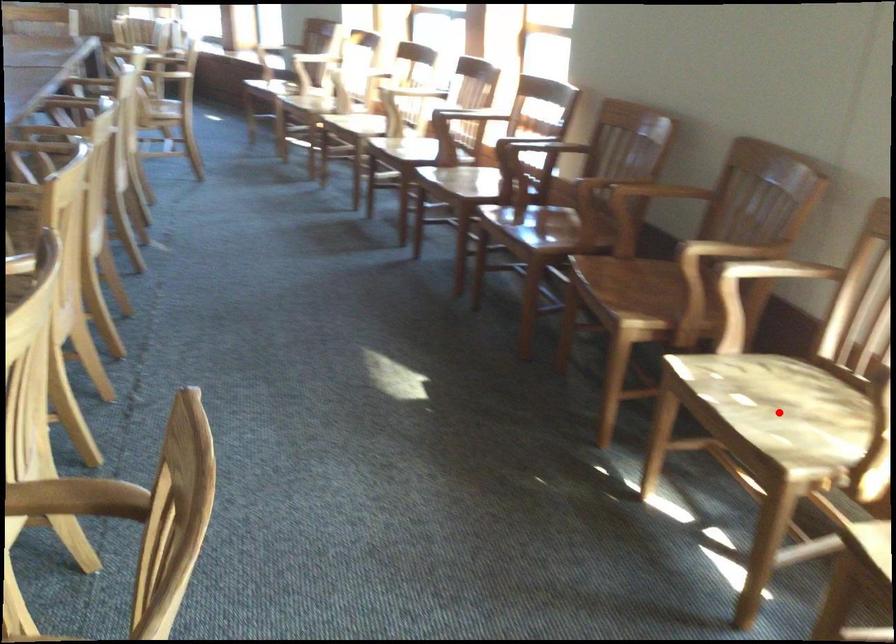
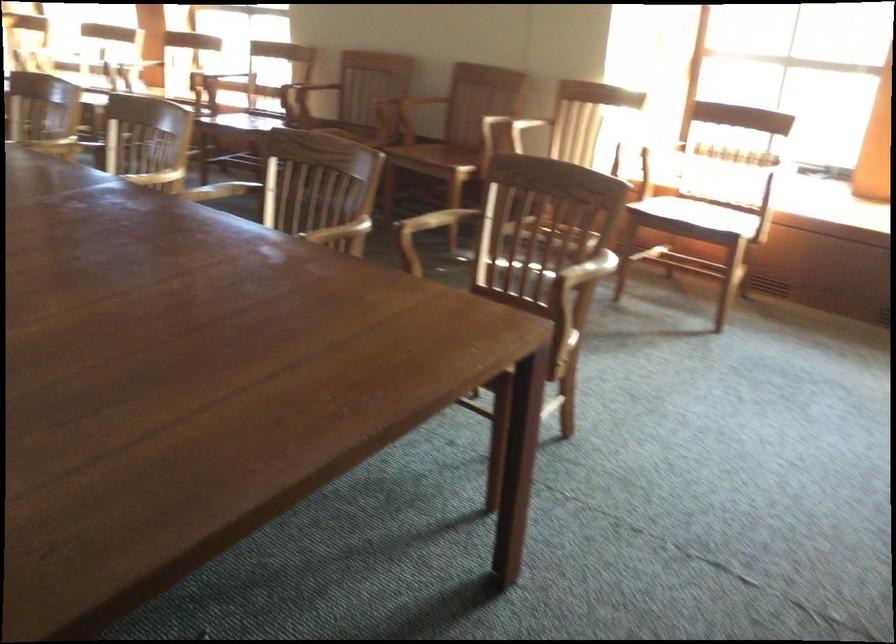
Question: I am providing you with two images of the same scene from different viewpoints. A red point is marked on the first image. Is the red point's position out of view in image 2?

Choices:
 (A) Yes
 (B) No

Answer: (A)